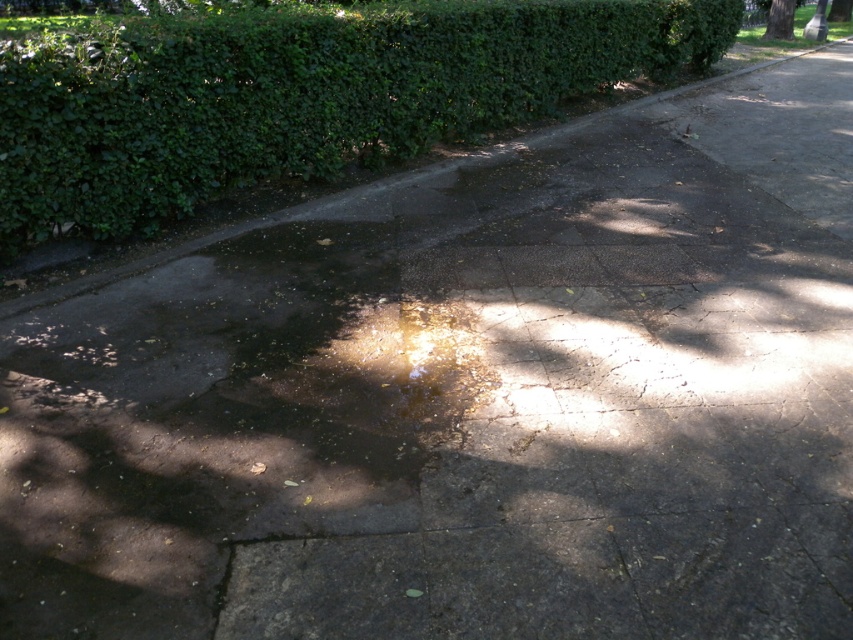
Can you confirm if green leafy hedge at upper left is smaller than green leafy tree at upper right?

No.

Is green leafy hedge at upper left above green leafy tree at upper right?

No.

You are a GUI agent. You are given a task and a screenshot of the screen. Output one action in this format:
    pyautogui.click(x=<x>, y=<y>)
    Task: Click on the green leafy hedge at upper left
    The image size is (853, 640).
    Given the screenshot: What is the action you would take?
    pyautogui.click(x=300, y=97)

The height and width of the screenshot is (640, 853). In order to click on green leafy hedge at upper left in this screenshot , I will do `click(300, 97)`.